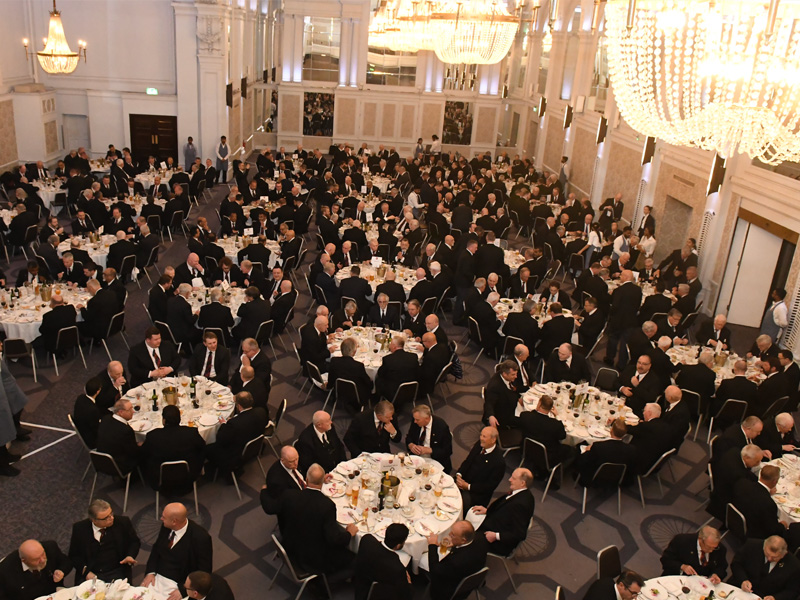
Locate an element on the screen. chandaliers is located at coordinates (58, 64), (388, 21), (474, 43), (714, 110).